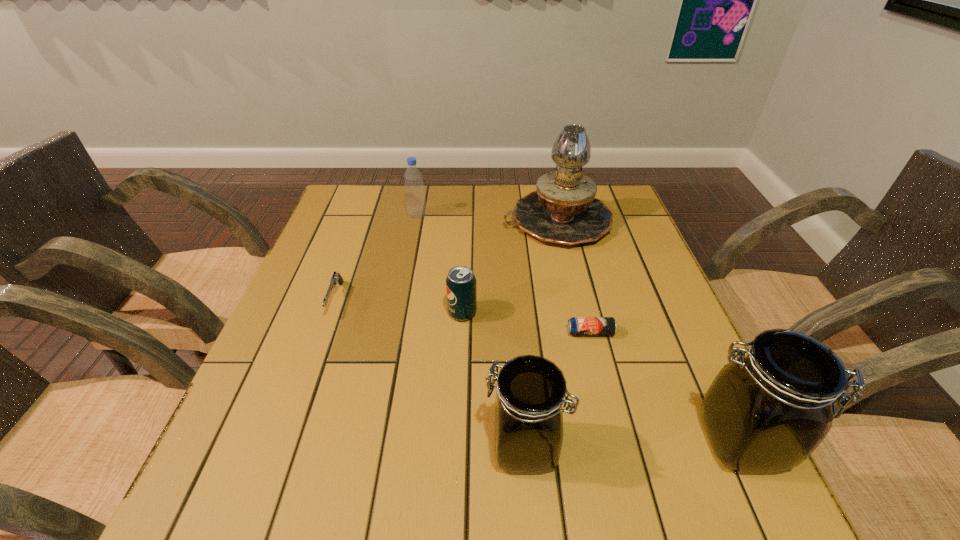
Locate an element on the screen. Image resolution: width=960 pixels, height=540 pixels. the shortest object is located at coordinates (577, 326).

Locate an element on the screen. blank area located 0.340m on the lid of the shorter jar is located at coordinates (287, 447).

In order to click on vacant region located 0.110m on the lid of the shorter jar in this screenshot , I will do `click(420, 447)`.

Locate an element on the screen. The height and width of the screenshot is (540, 960). vacant space located on the lid of the shorter jar is located at coordinates (299, 447).

You are a GUI agent. You are given a task and a screenshot of the screen. Output one action in this format:
    pyautogui.click(x=<x>, y=<y>)
    Task: Click on the free space located 0.120m on the front of the tallest object
    This screenshot has width=960, height=540.
    Given the screenshot: What is the action you would take?
    pyautogui.click(x=571, y=281)

Find the location of `vacant space located on the front of the bottle`. vacant space located on the front of the bottle is located at coordinates (397, 320).

The height and width of the screenshot is (540, 960). I want to click on free space located on the front-facing side of the leftmost object, so click(x=289, y=432).

Where is `vacant space located on the left of the fifth tallest object`? This screenshot has width=960, height=540. vacant space located on the left of the fifth tallest object is located at coordinates (395, 313).

Find the location of a particular element. vacant space located 0.270m on the left of the shortest object is located at coordinates (444, 333).

The height and width of the screenshot is (540, 960). In order to click on oil lamp that is at the far edge in this screenshot , I will do `click(563, 210)`.